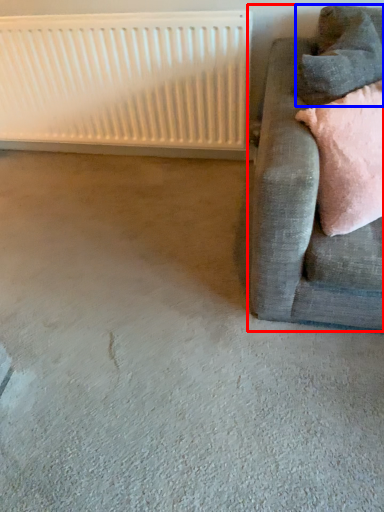
Question: Among these objects, which one is farthest to the camera, studio couch (highlighted by a red box) or pillow (highlighted by a blue box)?

Choices:
 (A) studio couch
 (B) pillow

Answer: (B)